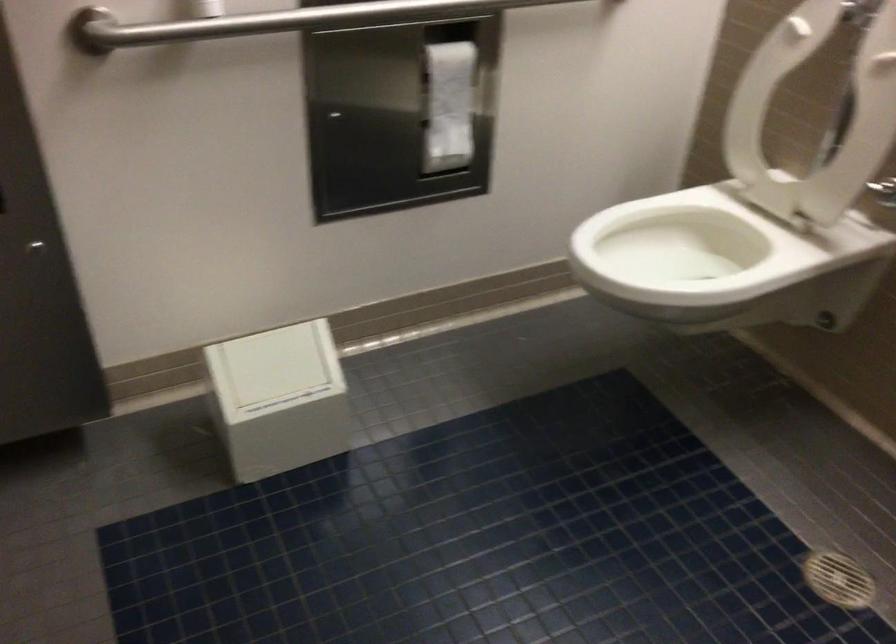
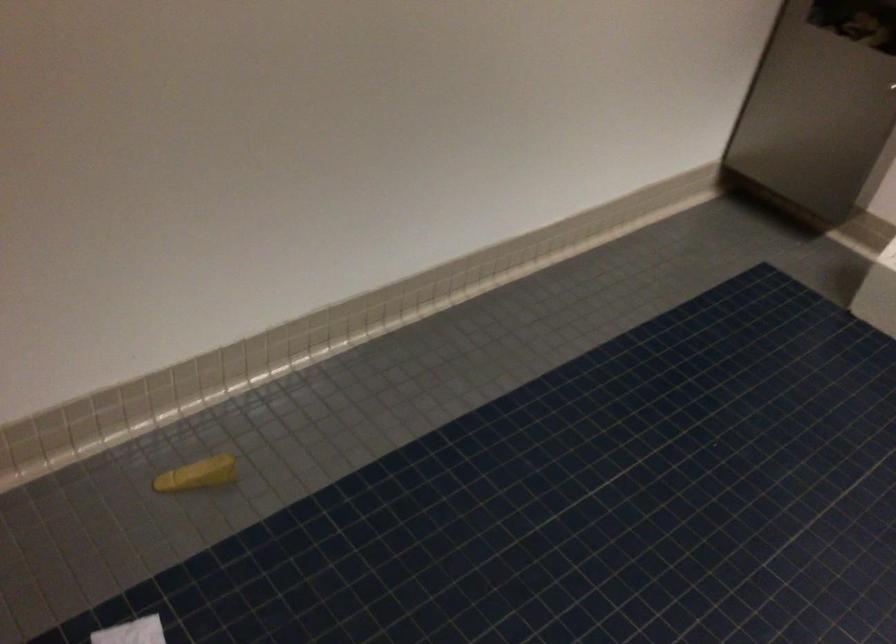
How did the camera likely rotate?

The rotation direction of the camera is left-down.